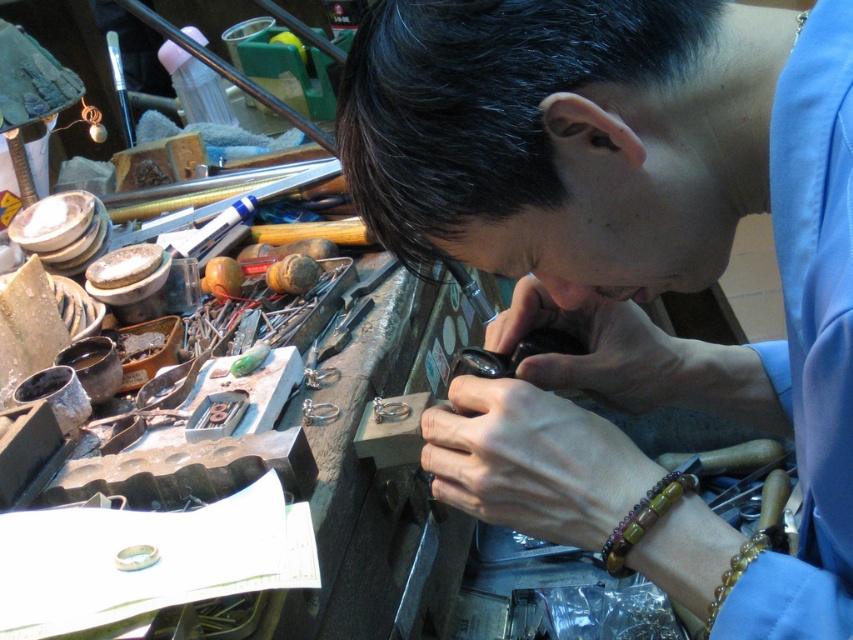
You are a jeweler working at this cluttered workstation. You need to reach for the multicolored wood beads at lower right and the brown polished bracelet at lower right. Which one is closer to your hand if you extend your right hand downward from your current position?

The brown polished bracelet at lower right is closer to your right hand because it is located below the multicolored wood beads at lower right.

You are a jeweler who needs to pick up the multicolored wood beads at lower right with your hand. Given that your hand is at smooth skin hand at center, can you reach the beads without moving your hand?

The distance between smooth skin hand at center and multicolored wood beads at lower right is 3.53 inches. Since the average human hand can reach approximately 2 inches without moving, you would need to move your hand to reach the beads.